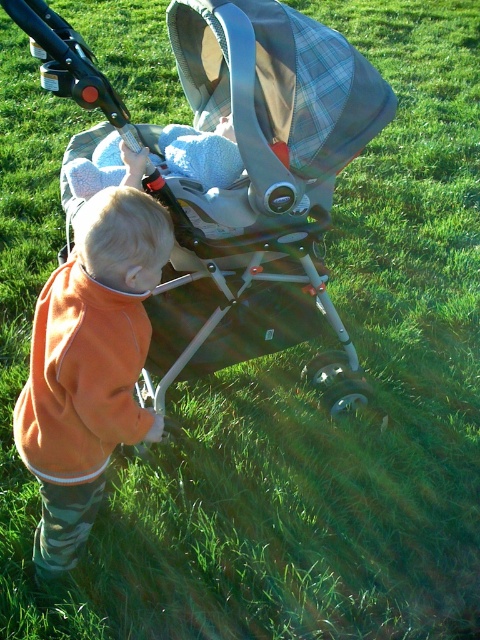
Based on the photo, is silver metallic stroller at center shorter than orange fleece jacket at center?

In fact, silver metallic stroller at center may be taller than orange fleece jacket at center.

Can you confirm if silver metallic stroller at center is bigger than orange fleece jacket at center?

Indeed, silver metallic stroller at center has a larger size compared to orange fleece jacket at center.

Is point (190, 352) more distant than point (123, 342)?

Yes, point (190, 352) is behind point (123, 342).

At what (x,y) coordinates should I click in order to perform the action: click on silver metallic stroller at center. Please return your answer as a coordinate pair (x, y). The height and width of the screenshot is (640, 480). Looking at the image, I should click on (240, 182).

Between orange fleece jacket at center and soft blue blanket at center, which one has less height?

soft blue blanket at center

Which is behind, point (75, 225) or point (192, 168)?

The point (192, 168) is behind.

Who is more forward, (44, 348) or (200, 177)?

Point (44, 348) is in front.

Where is `orange fleece jacket at center`? orange fleece jacket at center is located at coordinates (90, 365).

Between silver metallic stroller at center and soft blue blanket at center, which one is positioned lower?

Positioned lower is silver metallic stroller at center.

This screenshot has width=480, height=640. Describe the element at coordinates (240, 182) in the screenshot. I see `silver metallic stroller at center` at that location.

Is point (195, 198) in front of point (106, 157)?

That is True.

Locate an element on the screen. Image resolution: width=480 pixels, height=640 pixels. silver metallic stroller at center is located at coordinates (240, 182).